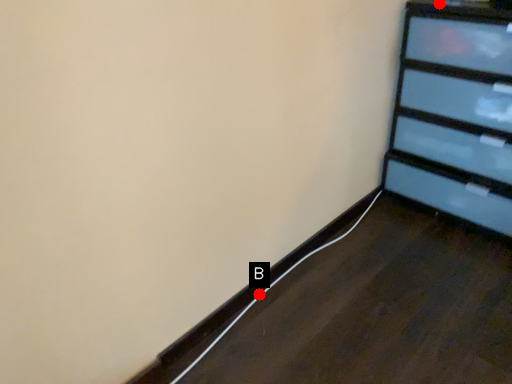
Question: Two points are circled on the image, labeled by A and B beside each circle. Which point appears closest to the camera in this image?

Choices:
 (A) A is closer
 (B) B is closer

Answer: (A)